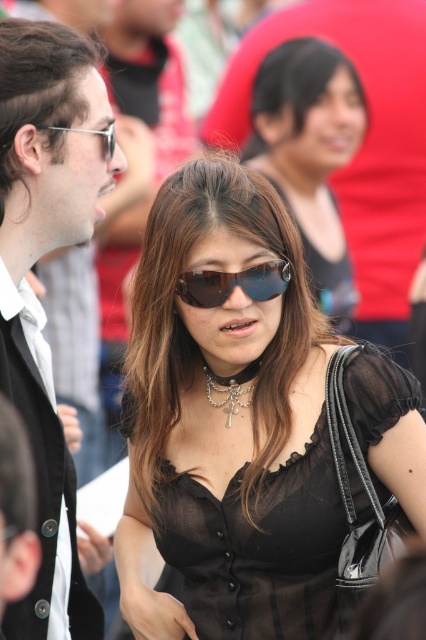
Who is taller, matte black jacket at left or silver metallic necklace at center?

With more height is matte black jacket at left.

Does matte black jacket at left have a smaller size compared to silver metallic necklace at center?

No, matte black jacket at left is not smaller than silver metallic necklace at center.

Where is `matte black jacket at left`? matte black jacket at left is located at coordinates (31, 291).

What are the coordinates of `matte black jacket at left` in the screenshot? It's located at (31, 291).

Between matte black jacket at left and matte silver goggles at upper left, which one has more height?

matte black jacket at left

Which is above, matte black jacket at left or matte silver goggles at upper left?

matte silver goggles at upper left is above.

Does point (8, 326) come behind point (54, 129)?

No, (8, 326) is in front of (54, 129).

Where is `matte black jacket at left`? The width and height of the screenshot is (426, 640). matte black jacket at left is located at coordinates (31, 291).

Can you confirm if matte black jacket at left is shorter than satin black blouse at center?

Indeed, matte black jacket at left has a lesser height compared to satin black blouse at center.

Consider the image. Can you confirm if matte black jacket at left is thinner than satin black blouse at center?

Correct, matte black jacket at left's width is less than satin black blouse at center's.

Does point (92, 160) come farther from viewer compared to point (314, 272)?

No, it is not.

The image size is (426, 640). Find the location of `matte black jacket at left`. matte black jacket at left is located at coordinates (31, 291).